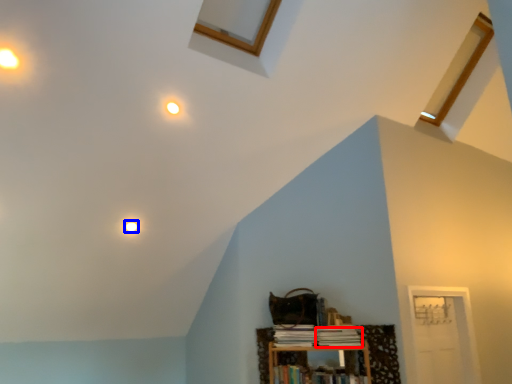
Question: Which object appears farthest to the camera in this image, book (highlighted by a red box) or light (highlighted by a blue box)?

Choices:
 (A) book
 (B) light

Answer: (B)